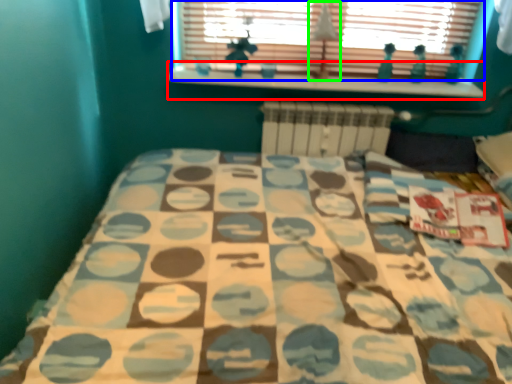
Question: Which object is the farthest from window sill (highlighted by a red box)? Choose among these: window (highlighted by a blue box) or lamp (highlighted by a green box).

Choices:
 (A) window
 (B) lamp

Answer: (B)